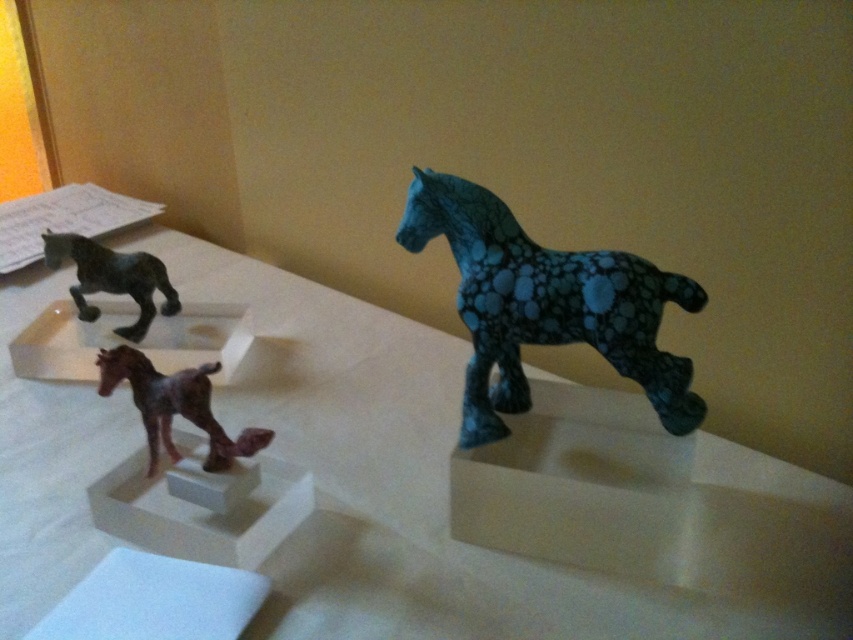
Does blue textured horse at center appear on the left side of brown matte horse at lower left?

Incorrect, blue textured horse at center is not on the left side of brown matte horse at lower left.

Does blue textured horse at center appear over brown matte horse at lower left?

Yes, blue textured horse at center is above brown matte horse at lower left.

Is point (468, 250) closer to viewer compared to point (177, 412)?

Yes, it is.

This screenshot has height=640, width=853. In order to click on blue textured horse at center in this screenshot , I will do `click(546, 305)`.

The image size is (853, 640). I want to click on blue textured horse at center, so click(546, 305).

Who is more distant from viewer, (634, 317) or (135, 328)?

The point (135, 328) is behind.

Is point (668, 378) more distant than point (111, 275)?

No, (668, 378) is in front of (111, 275).

Find the location of a particular element. Image resolution: width=853 pixels, height=640 pixels. blue textured horse at center is located at coordinates (546, 305).

Can you confirm if white plastic table at center is smaller than matte black horse at left?

Actually, white plastic table at center might be larger than matte black horse at left.

Can you confirm if white plastic table at center is positioned to the left of matte black horse at left?

In fact, white plastic table at center is to the right of matte black horse at left.

Is point (514, 595) farther from camera compared to point (144, 285)?

No, it is not.

Where is `white plastic table at center`? This screenshot has width=853, height=640. white plastic table at center is located at coordinates click(x=403, y=483).